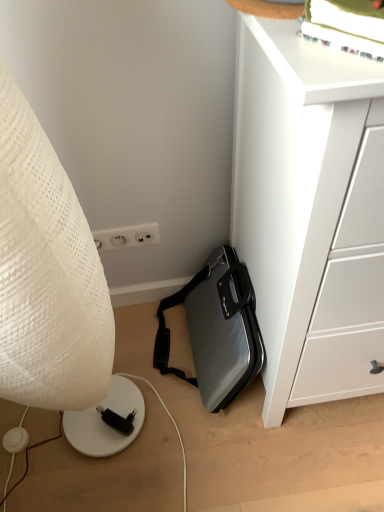
This screenshot has height=512, width=384. Identify the location of white textured lamp at left. (54, 291).

I want to click on white matte chest of drawers at lower right, so click(x=305, y=211).

Could you tell me if white textured lamp at left is facing silver textured briefcase at lower center?

No, white textured lamp at left is not oriented towards silver textured briefcase at lower center.

Is there a large distance between white textured lamp at left and silver textured briefcase at lower center?

They are positioned close to each other.

From the image's perspective, is white textured lamp at left beneath silver textured briefcase at lower center?

No, from the image's perspective, white textured lamp at left is not beneath silver textured briefcase at lower center.

Which is less distant, (14, 140) or (221, 330)?

Point (14, 140) is closer to the camera than point (221, 330).

Is white matte chest of drawers at lower right placed right next to silver textured briefcase at lower center?

white matte chest of drawers at lower right and silver textured briefcase at lower center are clearly separated.

In the scene shown: Considering the sizes of objects white matte chest of drawers at lower right and silver textured briefcase at lower center in the image provided, who is bigger, white matte chest of drawers at lower right or silver textured briefcase at lower center?

Bigger between the two is white matte chest of drawers at lower right.

Which is correct: white matte chest of drawers at lower right is inside silver textured briefcase at lower center, or outside of it?

white matte chest of drawers at lower right exists outside the volume of silver textured briefcase at lower center.

Which is in front, point (347, 137) or point (196, 290)?

Point (347, 137)

Does silver textured briefcase at lower center contain white textured lamp at left?

No, white textured lamp at left is not surrounded by silver textured briefcase at lower center.

Considering the relative positions of silver textured briefcase at lower center and white textured lamp at left in the image provided, is silver textured briefcase at lower center in front of white textured lamp at left?

No.

Considering the sizes of silver textured briefcase at lower center and white textured lamp at left in the image, is silver textured briefcase at lower center taller or shorter than white textured lamp at left?

Clearly, silver textured briefcase at lower center is shorter compared to white textured lamp at left.

Is silver textured briefcase at lower center positioned with its back to white textured lamp at left?

No, silver textured briefcase at lower center's orientation is not away from white textured lamp at left.

Is silver textured briefcase at lower center facing towards white matte chest of drawers at lower right?

No, silver textured briefcase at lower center is not turned towards white matte chest of drawers at lower right.

The width and height of the screenshot is (384, 512). Identify the location of the chest of drawers above the silver textured briefcase at lower center (from a real-world perspective). (305, 211).

Does white matte chest of drawers at lower right have a lesser width compared to white textured lamp at left?

No.

How different are the orientations of white matte chest of drawers at lower right and white textured lamp at left in degrees?

0.989 degrees.

Could you tell me if white matte chest of drawers at lower right is facing white textured lamp at left?

No, white matte chest of drawers at lower right does not turn towards white textured lamp at left.

Considering the positions of objects white textured lamp at left and white matte chest of drawers at lower right in the image provided, who is more to the left, white textured lamp at left or white matte chest of drawers at lower right?

From the viewer's perspective, white textured lamp at left appears more on the left side.

Would you say white textured lamp at left is a long distance from white matte chest of drawers at lower right?

Actually, white textured lamp at left and white matte chest of drawers at lower right are a little close together.

Does white textured lamp at left come behind white matte chest of drawers at lower right?

No, white textured lamp at left is closer to the viewer.

Is white textured lamp at left turned away from white matte chest of drawers at lower right?

No, white textured lamp at left's orientation is not away from white matte chest of drawers at lower right.

The width and height of the screenshot is (384, 512). I want to click on lamp above the silver textured briefcase at lower center (from a real-world perspective), so click(54, 291).

Find the location of `luggage and bags behind the white matte chest of drawers at lower right`. luggage and bags behind the white matte chest of drawers at lower right is located at coordinates (216, 330).

When comparing their distances from white matte chest of drawers at lower right, does silver textured briefcase at lower center or white textured lamp at left seem closer?

Among the two, silver textured briefcase at lower center is located nearer to white matte chest of drawers at lower right.

When comparing their distances from silver textured briefcase at lower center, does white textured lamp at left or white matte chest of drawers at lower right seem further?

white textured lamp at left.

Looking at the image, which one is located closer to white matte chest of drawers at lower right, white textured lamp at left or silver textured briefcase at lower center?

The object closer to white matte chest of drawers at lower right is silver textured briefcase at lower center.

Estimate the real-world distances between objects in this image. Which object is closer to silver textured briefcase at lower center, white matte chest of drawers at lower right or white textured lamp at left?

The object closer to silver textured briefcase at lower center is white matte chest of drawers at lower right.

Estimate the real-world distances between objects in this image. Which object is further from white textured lamp at left, white matte chest of drawers at lower right or silver textured briefcase at lower center?

The object further to white textured lamp at left is silver textured briefcase at lower center.

Based on their spatial positions, is silver textured briefcase at lower center or white matte chest of drawers at lower right closer to white textured lamp at left?

white matte chest of drawers at lower right is positioned closer to the anchor white textured lamp at left.

What are the coordinates of `luggage and bags located between white textured lamp at left and white matte chest of drawers at lower right in the left-right direction` in the screenshot? It's located at (216, 330).